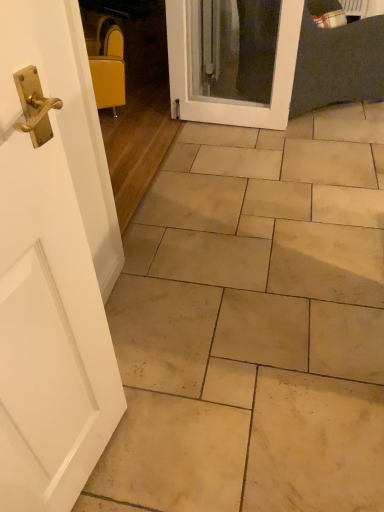
Identify the location of white glossy door at center. Image resolution: width=384 pixels, height=512 pixels. (231, 100).

What do you see at coordinates (108, 65) in the screenshot? I see `yellow fabric chair at upper left` at bounding box center [108, 65].

Locate an element on the screen. This screenshot has width=384, height=512. beige stone tile at center is located at coordinates (254, 324).

In the image, there is a white glossy door at center. What are the coordinates of `chair below it (from a real-world perspective)` in the screenshot? It's located at (108, 65).

Considering the positions of points (100, 27) and (281, 14), is point (100, 27) closer to camera compared to point (281, 14)?

That is False.

Is white glossy door at center inside yellow fabric chair at upper left?

Actually, white glossy door at center is outside yellow fabric chair at upper left.

From the image's perspective, is yellow fabric chair at upper left located above or below white glossy door at center?

yellow fabric chair at upper left is above white glossy door at center.

Which of these two, beige stone tile at center or white glossy door at center, is wider?

With larger width is beige stone tile at center.

Which of these two, beige stone tile at center or white glossy door at center, stands shorter?

Standing shorter between the two is beige stone tile at center.

From a real-world perspective, is beige stone tile at center positioned above or below white glossy door at center?

In terms of real-world spatial position, beige stone tile at center is below white glossy door at center.

Between beige stone tile at center and white glossy door at center, which one is positioned in front?

Positioned in front is beige stone tile at center.

In the scene shown: Is white glossy door at center thinner than beige stone tile at center?

Correct, the width of white glossy door at center is less than that of beige stone tile at center.

Does white glossy door at center have a greater height compared to beige stone tile at center?

Indeed, white glossy door at center has a greater height compared to beige stone tile at center.

From the image's perspective, which one is positioned higher, white glossy door at center or beige stone tile at center?

white glossy door at center, from the image's perspective.

From a real-world perspective, is white glossy door at center physically located above or below beige stone tile at center?

white glossy door at center is above beige stone tile at center.

Find the location of a particular element. Image resolution: width=384 pixels, height=512 pixels. door in front of the yellow fabric chair at upper left is located at coordinates (231, 100).

Does white glossy door at center lie behind yellow fabric chair at upper left?

That is False.

Which point is more distant from viewer, (287, 42) or (111, 76)?

The point (111, 76) is farther from the camera.

Would you say white glossy door at center is outside yellow fabric chair at upper left?

Yes, white glossy door at center is outside of yellow fabric chair at upper left.

Do you think yellow fabric chair at upper left is within beige stone tile at center, or outside of it?

yellow fabric chair at upper left is not inside beige stone tile at center, it's outside.

Is yellow fabric chair at upper left oriented towards beige stone tile at center?

No, yellow fabric chair at upper left is not facing towards beige stone tile at center.

Which object is further away from the camera taking this photo, yellow fabric chair at upper left or beige stone tile at center?

yellow fabric chair at upper left.

Where is `ceramic tile in front of the yellow fabric chair at upper left`? The width and height of the screenshot is (384, 512). ceramic tile in front of the yellow fabric chair at upper left is located at coordinates (254, 324).

Is beige stone tile at center oriented away from yellow fabric chair at upper left?

beige stone tile at center is not turned away from yellow fabric chair at upper left.

Considering the positions of objects beige stone tile at center and yellow fabric chair at upper left in the image provided, who is behind, beige stone tile at center or yellow fabric chair at upper left?

yellow fabric chair at upper left is further away from the camera.

Is beige stone tile at center taller or shorter than yellow fabric chair at upper left?

Considering their sizes, beige stone tile at center has less height than yellow fabric chair at upper left.

Locate an element on the screen. door below the yellow fabric chair at upper left (from the image's perspective) is located at coordinates (231, 100).

Locate an element on the screen. door positioned vertically above the beige stone tile at center (from a real-world perspective) is located at coordinates (231, 100).

When comparing their distances from white glossy door at center, does yellow fabric chair at upper left or beige stone tile at center seem closer?

yellow fabric chair at upper left.

When comparing their distances from yellow fabric chair at upper left, does white glossy door at center or beige stone tile at center seem further?

The object further to yellow fabric chair at upper left is beige stone tile at center.

Looking at the image, which one is located closer to beige stone tile at center, yellow fabric chair at upper left or white glossy door at center?

The object closer to beige stone tile at center is white glossy door at center.

Considering their positions, is beige stone tile at center positioned further to white glossy door at center than yellow fabric chair at upper left?

Among the two, beige stone tile at center is located further to white glossy door at center.

Which object lies nearer to the anchor point yellow fabric chair at upper left, beige stone tile at center or white glossy door at center?

white glossy door at center is closer to yellow fabric chair at upper left.

Which object lies further to the anchor point beige stone tile at center, white glossy door at center or yellow fabric chair at upper left?

The object further to beige stone tile at center is yellow fabric chair at upper left.

Identify the location of door between beige stone tile at center and yellow fabric chair at upper left from front to back. (231, 100).